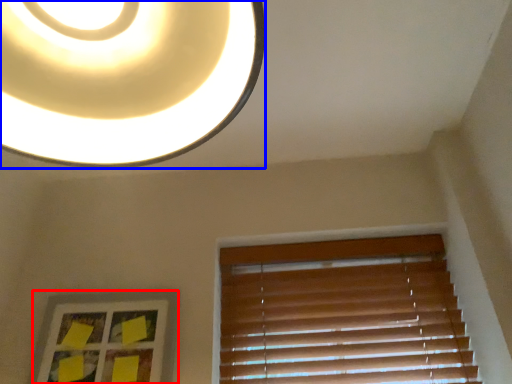
Question: Among these objects, which one is farthest to the camera, picture frame (highlighted by a red box) or lamp (highlighted by a blue box)?

Choices:
 (A) picture frame
 (B) lamp

Answer: (A)